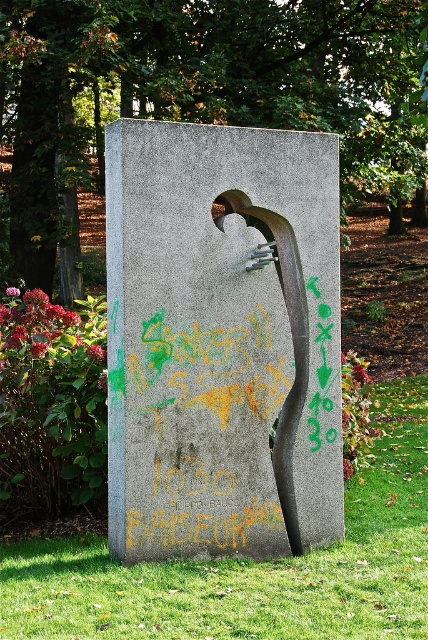
Question: Which point is closer to the camera taking this photo?

Choices:
 (A) (178, 611)
 (B) (187, 541)

Answer: (A)

Question: Can you confirm if gray concrete sculpture at center is positioned to the left of green grass at lower center?

Choices:
 (A) no
 (B) yes

Answer: (A)

Question: Considering the real-world distances, which object is closest to the yellow graffiti at center?

Choices:
 (A) gray concrete sculpture at center
 (B) green grass at lower center

Answer: (B)

Question: Considering the real-world distances, which object is farthest from the yellow graffiti at center?

Choices:
 (A) gray concrete sculpture at center
 (B) green grass at lower center

Answer: (A)

Question: Is the position of gray concrete sculpture at center less distant than that of yellow graffiti at center?

Choices:
 (A) yes
 (B) no

Answer: (A)

Question: Does green grass at lower center appear under yellow graffiti at center?

Choices:
 (A) no
 (B) yes

Answer: (B)